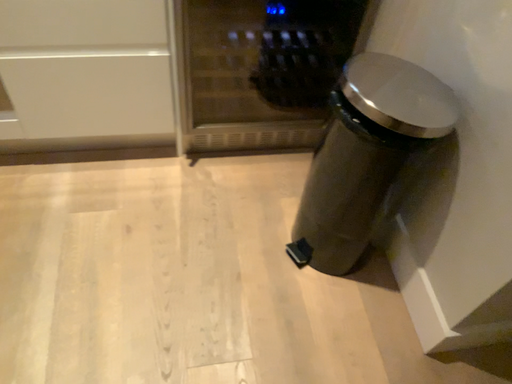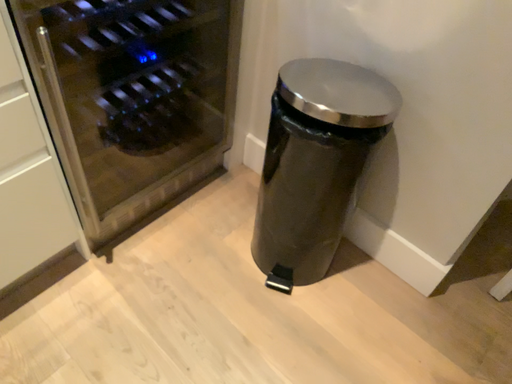
Question: How did the camera likely rotate when shooting the video?

Choices:
 (A) rotated downward
 (B) rotated upward

Answer: (B)